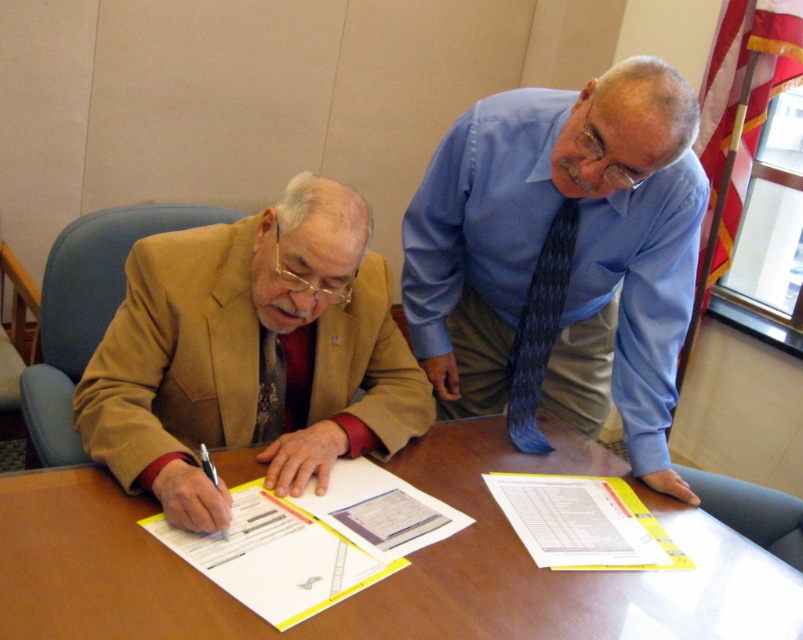
You are an interior designer analyzing the spatial layout of this office scene. The matte brown suit at left is positioned at coordinates 0.553, 0.313. Can you determine if this location is within the standard 2D workspace area typically found in such settings?

The standard 2D workspace area in an office setting is usually centered around the desk where work activities occur. Since the matte brown suit at left is located at coordinates (251, 353), which falls within the typical central workspace area of an office desk, it is likely positioned appropriately for interacting with the document and the seated individual.

You are a tailor who needs to adjust the width of the matte brown suit at left and the dark red textured tie at left to ensure they fit perfectly on a mannequin. Which item requires more width reduction to match the other?

The matte brown suit at left is wider than the dark red textured tie at left, so the matte brown suit at left requires more width reduction to match the dark red textured tie at left.

You are an observer in the scene. You see the matte brown suit at left and the dark red textured tie at left. Which one is positioned more to the right?

The matte brown suit at left is positioned more to the right than the dark red textured tie at left.